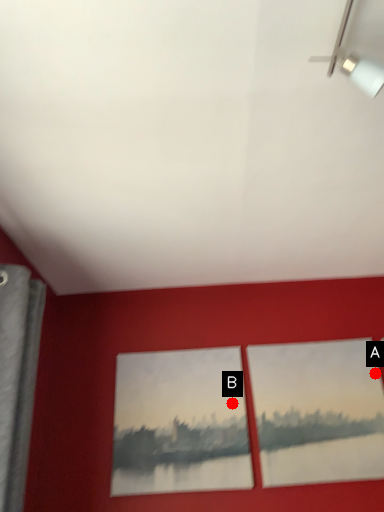
Question: Two points are circled on the image, labeled by A and B beside each circle. Which point appears farthest from the camera in this image?

Choices:
 (A) A is further
 (B) B is further

Answer: (A)